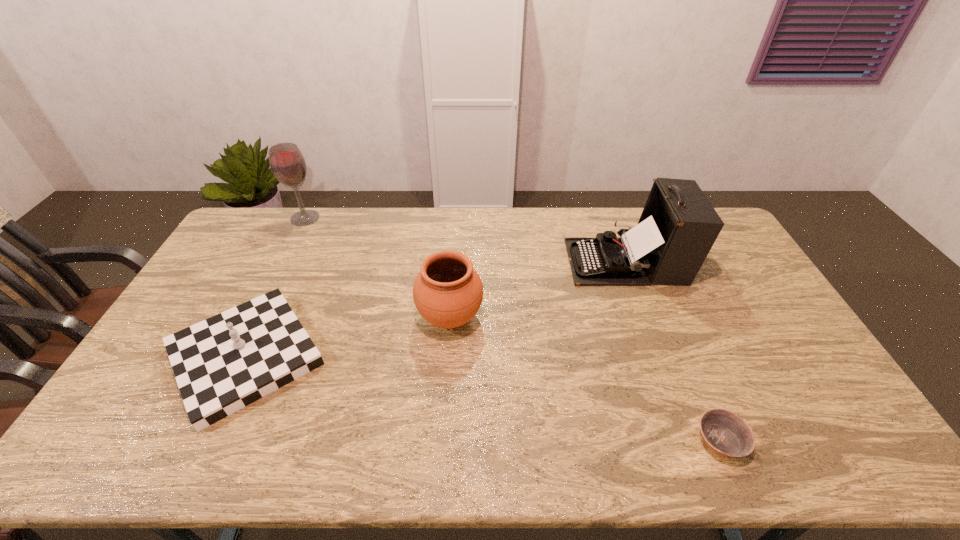
Where is `blank area in the image that satisfies the following two spatial constraints: 1. inside the open case of the typewriter; 2. on the back side of the shortest object`? This screenshot has width=960, height=540. blank area in the image that satisfies the following two spatial constraints: 1. inside the open case of the typewriter; 2. on the back side of the shortest object is located at coordinates (692, 440).